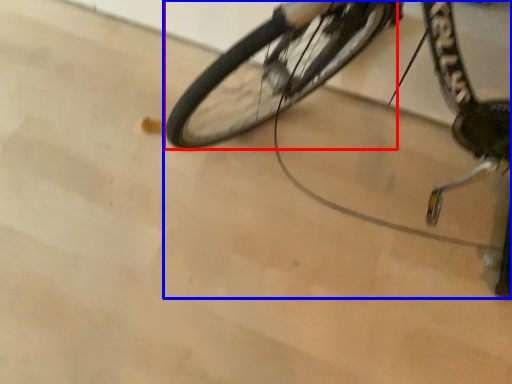
Question: Among these objects, which one is farthest to the camera, bicycle wheel (highlighted by a red box) or bicycle (highlighted by a blue box)?

Choices:
 (A) bicycle wheel
 (B) bicycle

Answer: (A)